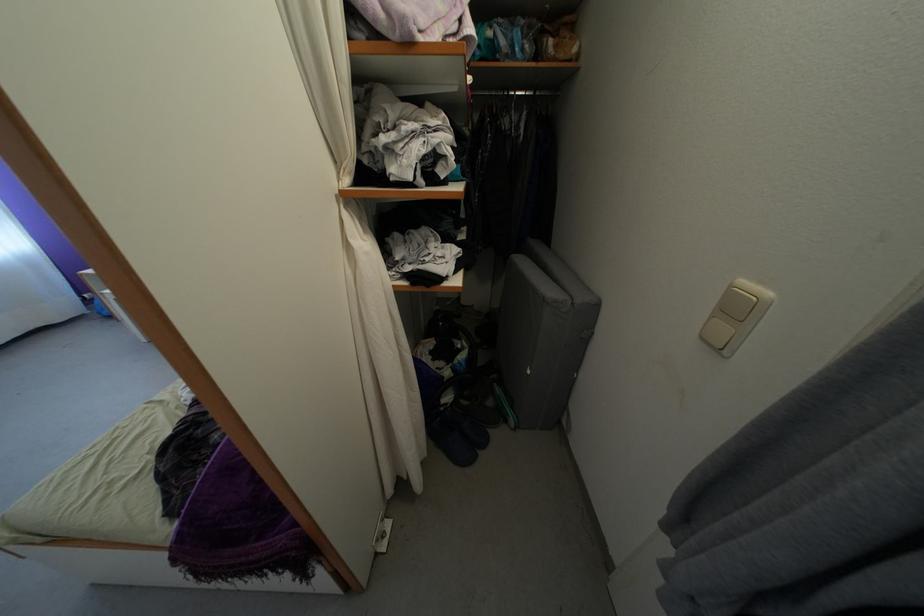
Describe the element at coordinates (365, 275) in the screenshot. I see `a white cloth curtain` at that location.